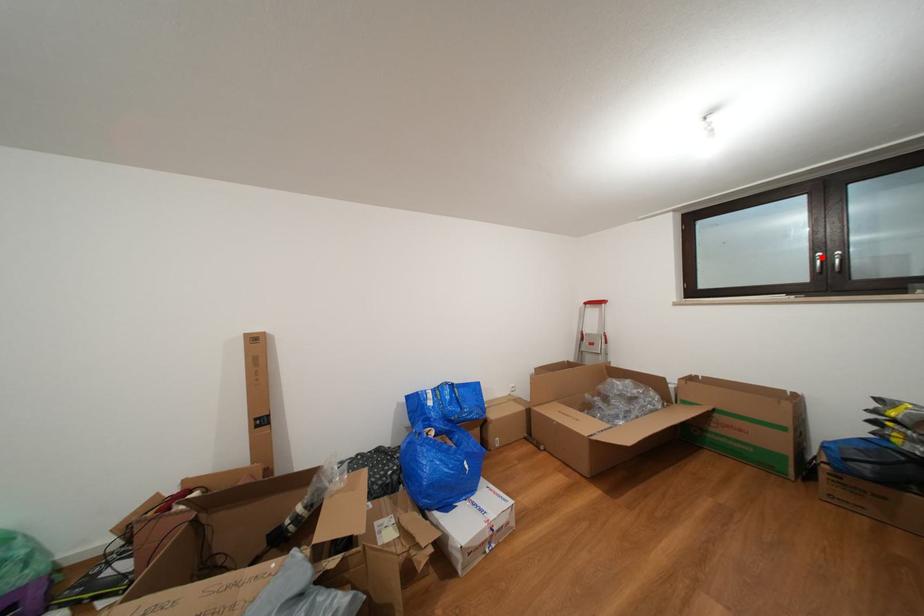
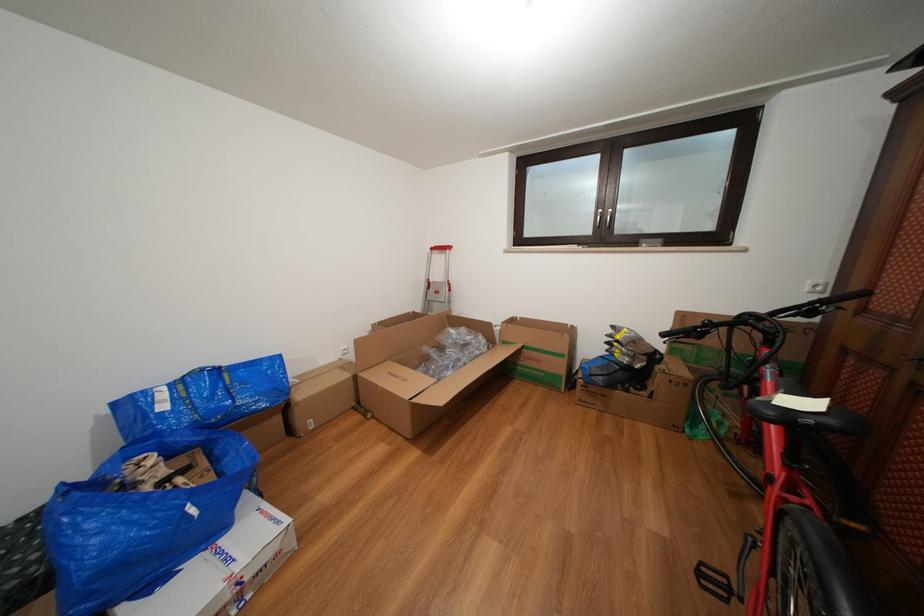
Question: I am providing you with two images of the same scene from different viewpoints. Given a red point in image1, look at the same physical point in image2. Is it:

Choices:
 (A) Closer to the viewpoint
 (B) Farther from the viewpoint

Answer: (A)